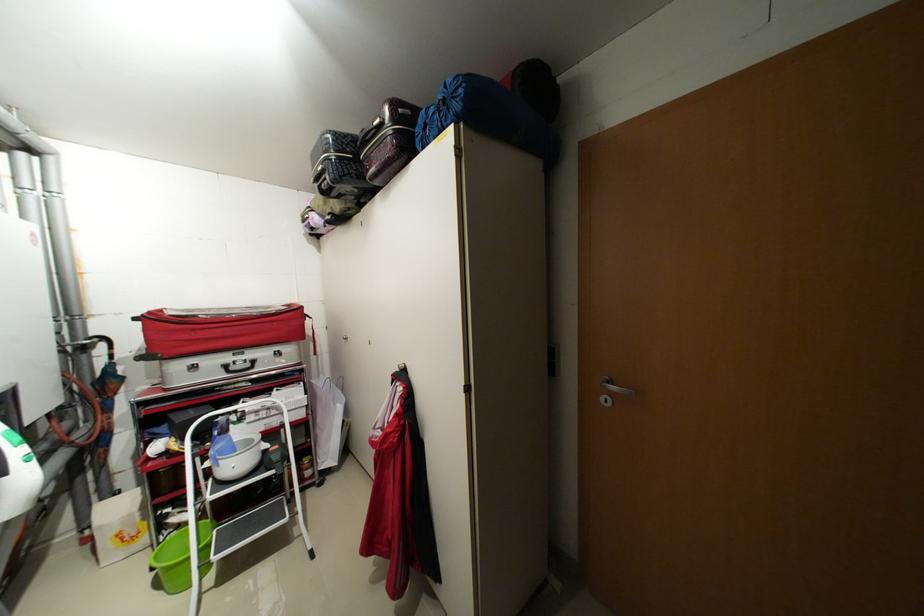
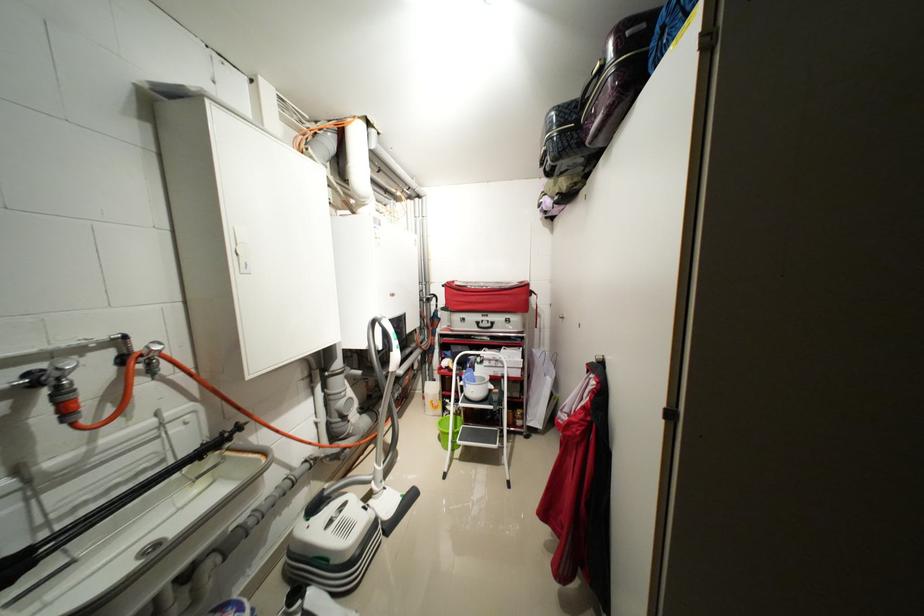
Locate, in the second image, the point that corresponds to point (263, 411) in the first image.

(496, 361)